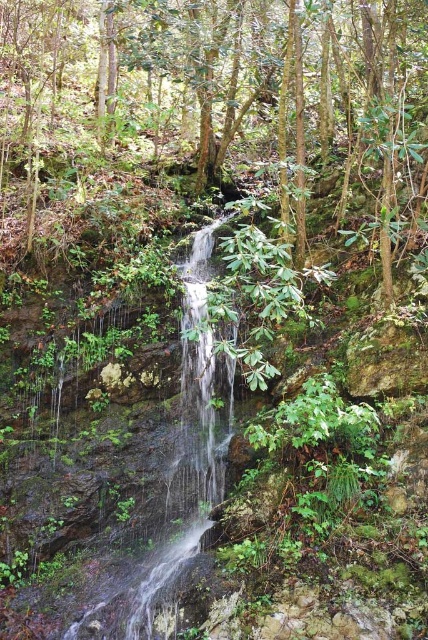
Does green leafy tree at center appear over clear water at center?

Yes.

The width and height of the screenshot is (428, 640). What do you see at coordinates (217, 93) in the screenshot?
I see `green leafy tree at center` at bounding box center [217, 93].

Find the location of a particular element. green leafy tree at center is located at coordinates (217, 93).